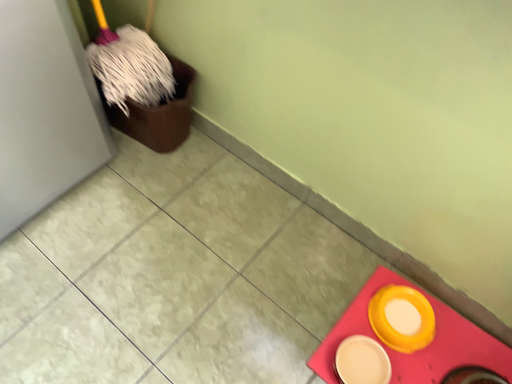
Locate an element on the screen. The image size is (512, 384). free location to the left of matte yellow plate at lower right, which ranks as the 2th tableware in right-to-left order is located at coordinates (289, 341).